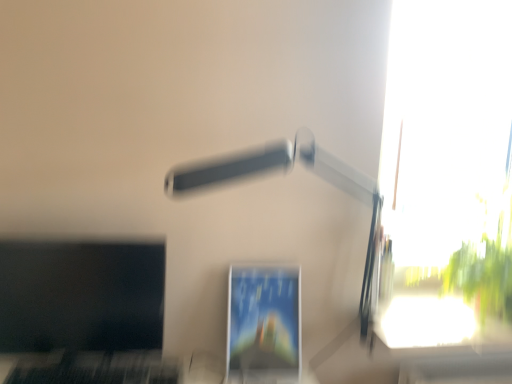
The image size is (512, 384). In order to click on transparent glass window at upper right in this screenshot , I will do `click(445, 130)`.

The height and width of the screenshot is (384, 512). What do you see at coordinates (96, 369) in the screenshot?
I see `black matte keyboard at lower left` at bounding box center [96, 369].

What do you see at coordinates (288, 170) in the screenshot? The width and height of the screenshot is (512, 384). I see `white plastic lamp at upper center` at bounding box center [288, 170].

Measure the distance between point (195, 170) and camera.

Point (195, 170) and camera are 34.84 inches apart from each other.

The height and width of the screenshot is (384, 512). In order to click on matte black monitor at left, the second computer monitor in the right-to-left sequence in this screenshot , I will do `click(81, 297)`.

Identify the location of transparent glass window at upper right. (445, 130).

Can you confirm if transparent glass window at upper right is thinner than matte black monitor at left, the second computer monitor in the right-to-left sequence?

In fact, transparent glass window at upper right might be wider than matte black monitor at left, the second computer monitor in the right-to-left sequence.

Is transparent glass window at upper right next to matte black monitor at left, arranged as the 1th computer monitor when viewed from the left?

They are not placed beside each other.

This screenshot has width=512, height=384. What are the coordinates of `window on the right of the matte black monitor at left, the second computer monitor in the right-to-left sequence` in the screenshot? It's located at (445, 130).

Is the position of transparent glass window at upper right more distant than that of matte black monitor at left, arranged as the 1th computer monitor when viewed from the left?

Yes, it is.

Can you tell me how much black matte keyboard at lower left and white plastic lamp at upper center differ in facing direction?

black matte keyboard at lower left and white plastic lamp at upper center are facing 92.6 degrees away from each other.

Which is in front, point (179, 364) or point (205, 177)?

The point (205, 177) is closer to the camera.

Does black matte keyboard at lower left contain white plastic lamp at upper center?

That's incorrect, white plastic lamp at upper center is not inside black matte keyboard at lower left.

From the transparent glass window at upper right, count the 1st computer monitor to the left and point to it. Please provide its 2D coordinates.

[(264, 320)]

Between matte plastic monitor at center, the second computer monitor from the left, and transparent glass window at upper right, which one has less height?

matte plastic monitor at center, the second computer monitor from the left, is shorter.

In the scene shown: From the image's perspective, does matte plastic monitor at center, the second computer monitor from the left, appear lower than transparent glass window at upper right?

Correct, matte plastic monitor at center, the second computer monitor from the left, appears lower than transparent glass window at upper right in the image.

What's the angular difference between matte plastic monitor at center, the second computer monitor from the left, and transparent glass window at upper right's facing directions?

3.65 degrees.

Is white plastic lamp at upper center inside the boundaries of transparent glass window at upper right, or outside?

white plastic lamp at upper center is located beyond the bounds of transparent glass window at upper right.

Considering the positions of objects white plastic lamp at upper center and transparent glass window at upper right in the image provided, who is more to the right, white plastic lamp at upper center or transparent glass window at upper right?

From the viewer's perspective, transparent glass window at upper right appears more on the right side.

Is point (210, 164) closer to camera compared to point (396, 14)?

Yes.

How different are the orientations of white plastic lamp at upper center and transparent glass window at upper right in degrees?

They differ by 89.4 degrees in their facing directions.

Is point (1, 265) closer to viewer compared to point (294, 352)?

That is True.

Is matte black monitor at left, arranged as the 1th computer monitor when viewed from the left, situated inside matte plastic monitor at center, which is the first computer monitor from right to left, or outside?

matte black monitor at left, arranged as the 1th computer monitor when viewed from the left, is not enclosed by matte plastic monitor at center, which is the first computer monitor from right to left.

Which of these two, matte black monitor at left, the second computer monitor in the right-to-left sequence, or matte plastic monitor at center, the second computer monitor from the left, is wider?

matte plastic monitor at center, the second computer monitor from the left, is wider.

Which is more to the left, matte black monitor at left, the second computer monitor in the right-to-left sequence, or matte plastic monitor at center, which is the first computer monitor from right to left?

From the viewer's perspective, matte black monitor at left, the second computer monitor in the right-to-left sequence, appears more on the left side.

From the image's perspective, which one is positioned higher, black matte keyboard at lower left or matte black monitor at left, arranged as the 1th computer monitor when viewed from the left?

matte black monitor at left, arranged as the 1th computer monitor when viewed from the left.

Considering the sizes of objects black matte keyboard at lower left and matte black monitor at left, arranged as the 1th computer monitor when viewed from the left, in the image provided, who is wider, black matte keyboard at lower left or matte black monitor at left, arranged as the 1th computer monitor when viewed from the left,?

black matte keyboard at lower left is wider.

Is black matte keyboard at lower left spatially inside matte black monitor at left, arranged as the 1th computer monitor when viewed from the left, or outside of it?

The correct answer is: inside.

From a real-world perspective, does white plastic lamp at upper center sit lower than matte plastic monitor at center, which is the first computer monitor from right to left?

No, from a real-world perspective, white plastic lamp at upper center is not under matte plastic monitor at center, which is the first computer monitor from right to left.

I want to click on lamp lying on the right of matte plastic monitor at center, which is the first computer monitor from right to left, so click(288, 170).

Does white plastic lamp at upper center have a greater width compared to matte plastic monitor at center, the second computer monitor from the left?

Yes, white plastic lamp at upper center is wider than matte plastic monitor at center, the second computer monitor from the left.

I want to click on the 1st computer monitor located beneath the transparent glass window at upper right (from a real-world perspective), so click(81, 297).

Image resolution: width=512 pixels, height=384 pixels. I want to click on lamp above the black matte keyboard at lower left (from a real-world perspective), so click(288, 170).

Looking at the image, which one is located further to matte black monitor at left, the second computer monitor in the right-to-left sequence, black matte keyboard at lower left or matte plastic monitor at center, the second computer monitor from the left?

The object further to matte black monitor at left, the second computer monitor in the right-to-left sequence, is matte plastic monitor at center, the second computer monitor from the left.

When comparing their distances from matte black monitor at left, arranged as the 1th computer monitor when viewed from the left, does transparent glass window at upper right or black matte keyboard at lower left seem closer?

Based on the image, black matte keyboard at lower left appears to be nearer to matte black monitor at left, arranged as the 1th computer monitor when viewed from the left.

Based on their spatial positions, is transparent glass window at upper right or matte plastic monitor at center, the second computer monitor from the left, closer to white plastic lamp at upper center?

Among the two, matte plastic monitor at center, the second computer monitor from the left, is located nearer to white plastic lamp at upper center.

When comparing their distances from white plastic lamp at upper center, does matte black monitor at left, arranged as the 1th computer monitor when viewed from the left, or transparent glass window at upper right seem closer?

The object closer to white plastic lamp at upper center is matte black monitor at left, arranged as the 1th computer monitor when viewed from the left.

When comparing their distances from matte black monitor at left, arranged as the 1th computer monitor when viewed from the left, does white plastic lamp at upper center or transparent glass window at upper right seem closer?

white plastic lamp at upper center lies closer to matte black monitor at left, arranged as the 1th computer monitor when viewed from the left, than the other object.

Looking at the image, which one is located further to white plastic lamp at upper center, matte plastic monitor at center, which is the first computer monitor from right to left, or matte black monitor at left, arranged as the 1th computer monitor when viewed from the left?

matte black monitor at left, arranged as the 1th computer monitor when viewed from the left, lies further to white plastic lamp at upper center than the other object.

When comparing their distances from matte plastic monitor at center, the second computer monitor from the left, does transparent glass window at upper right or black matte keyboard at lower left seem further?

Based on the image, transparent glass window at upper right appears to be further to matte plastic monitor at center, the second computer monitor from the left.

From the image, which object appears to be farther from matte plastic monitor at center, the second computer monitor from the left, matte black monitor at left, the second computer monitor in the right-to-left sequence, or black matte keyboard at lower left?

matte black monitor at left, the second computer monitor in the right-to-left sequence, lies further to matte plastic monitor at center, the second computer monitor from the left, than the other object.

What are the coordinates of `laptop keyboard between matte black monitor at left, the second computer monitor in the right-to-left sequence, and matte plastic monitor at center, which is the first computer monitor from right to left` in the screenshot? It's located at (96, 369).

The width and height of the screenshot is (512, 384). Identify the location of computer monitor located between black matte keyboard at lower left and transparent glass window at upper right in the left-right direction. (264, 320).

This screenshot has width=512, height=384. In order to click on computer monitor located between matte black monitor at left, arranged as the 1th computer monitor when viewed from the left, and transparent glass window at upper right in the left-right direction in this screenshot , I will do `click(264, 320)`.

The width and height of the screenshot is (512, 384). Find the location of `computer monitor situated between black matte keyboard at lower left and white plastic lamp at upper center from left to right`. computer monitor situated between black matte keyboard at lower left and white plastic lamp at upper center from left to right is located at coordinates (264, 320).